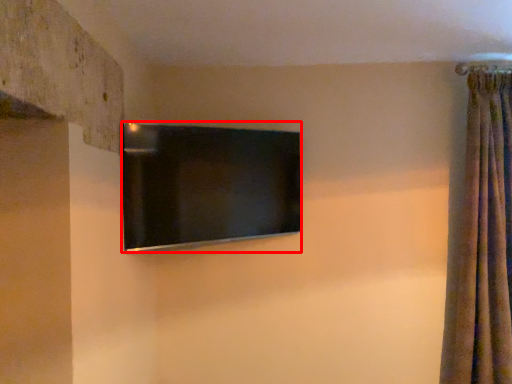
Question: Observing the image, what is the correct spatial positioning of television (annotated by the red box) in reference to curtain?

Choices:
 (A) left
 (B) right

Answer: (A)